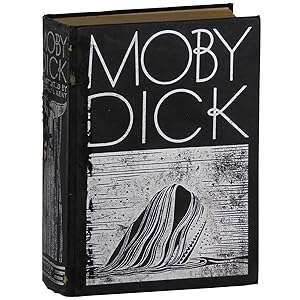
Find the location of `book`. book is located at coordinates (81, 102).